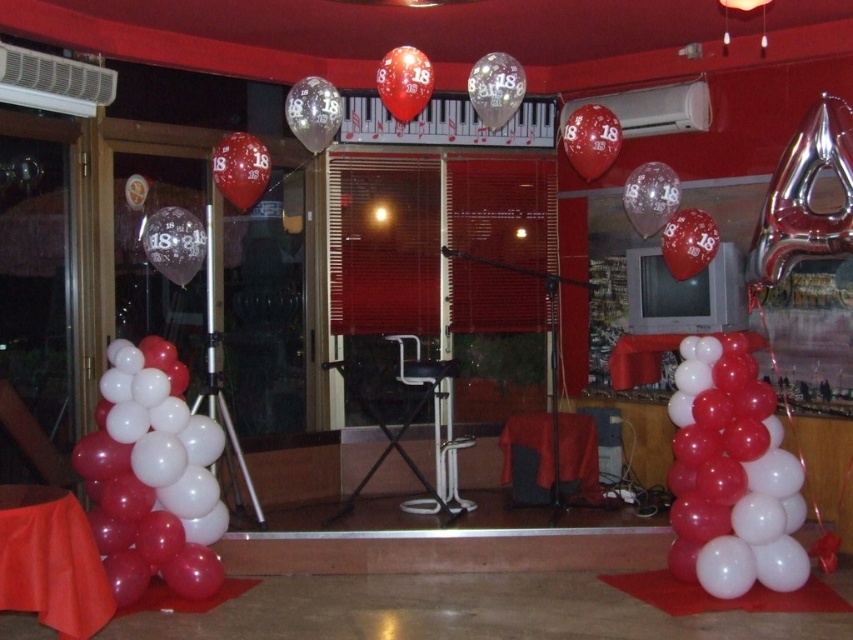
You are a party planner who needs to place a 2.5 meter long banner between the white glossy balloons at left and the transparent glittery balloon at upper center. Will the banner fit without bending or overlapping the balloons?

The distance between the white glossy balloons at left and the transparent glittery balloon at upper center is 2.40 meters. Since the banner is 2.5 meters long, it will not fit without bending or overlapping the balloons as it is longer than the available space.

You are a guest at the party and want to take a photo with the balloons. If you stand in front of the white glossy balloons at left, will the transparent glossy balloon at center appear behind or in front of them in the photo?

The transparent glossy balloon at center appears behind the white glossy balloons at left because the white glossy balloons at left are closer to the viewer than the transparent glossy balloon at center.

You are planning to take a photo of the birthday party decorations. You want to ensure that both the white glossy balloons at lower right and the shiny metallic balloon at center are clearly visible. Considering their sizes, which balloon will appear larger in the photo?

The white glossy balloons at lower right will appear larger in the photo because they are bigger than the shiny metallic balloon at center.